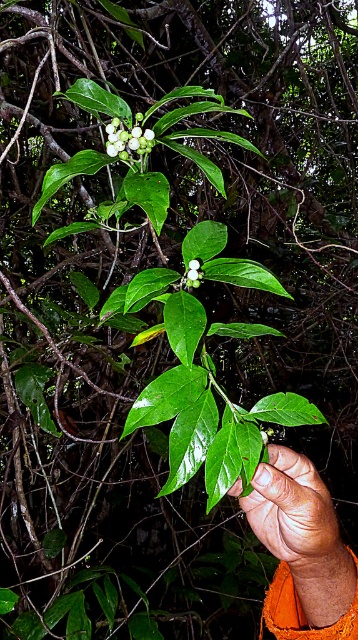
You are a botanist examining this plant. You notice two points marked on the image. The first point is at coordinate point (x=263, y=540) and the second is at point (x=108, y=144). Which point is closer to you?

Point (x=263, y=540) is closer to you because it is further to the viewer than point (x=108, y=144).

You are a botanist examining a plant with a brown skin at center and a white matte flower at center. Which part is closer to your eyes when observing the plant?

The brown skin at center is closer to the viewer than the white matte flower at center.

You are a botanist examining a plant with berries. You notice a point marked at coordinates (293,513). What is located at that point?

At point (293,513) lies brown skin at center.